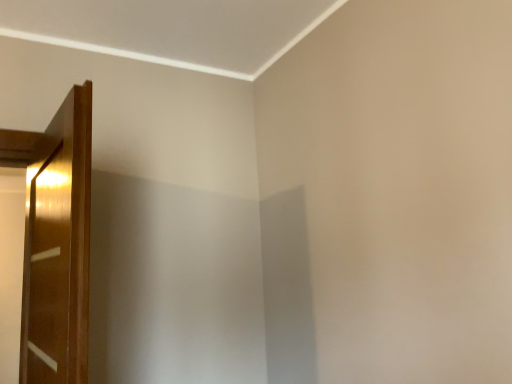
This screenshot has height=384, width=512. In order to click on wooden door at left in this screenshot , I will do `click(58, 248)`.

The height and width of the screenshot is (384, 512). What do you see at coordinates (58, 248) in the screenshot? I see `wooden door at left` at bounding box center [58, 248].

Find the location of a particular element. wooden door at left is located at coordinates (58, 248).